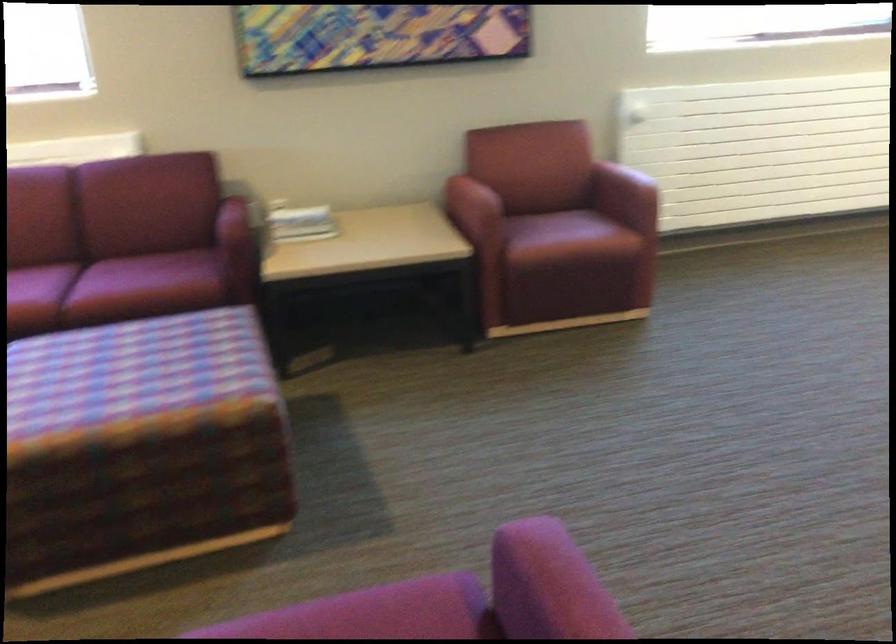
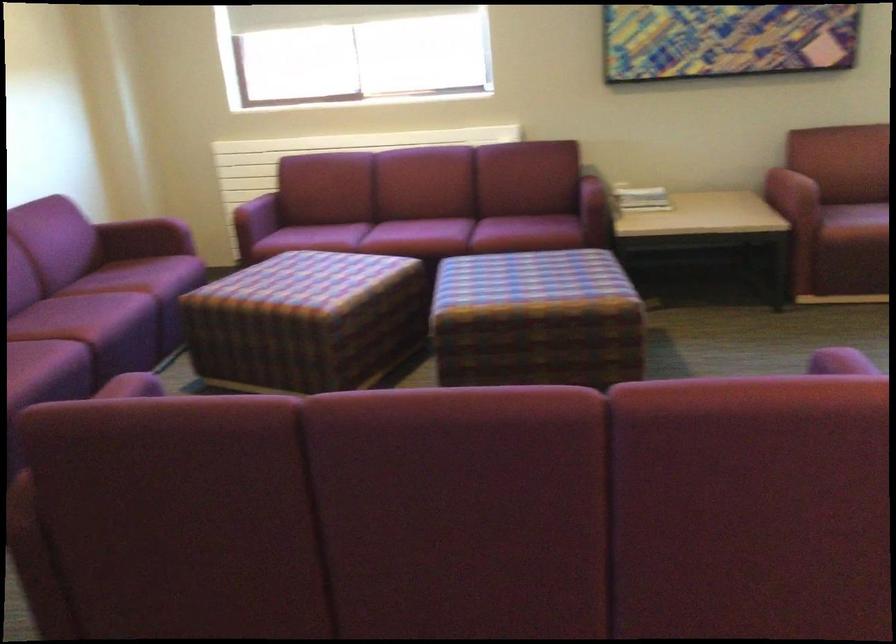
Locate, in the second image, the point that corresponds to [533,567] in the first image.

(840, 362)